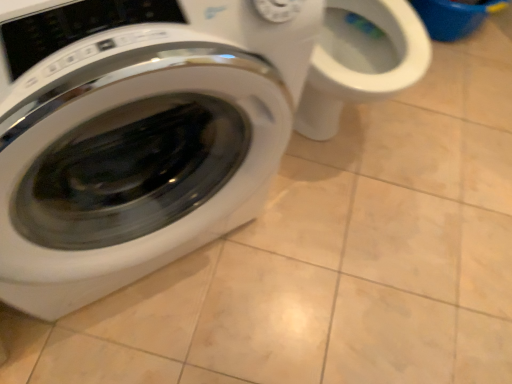
Question: Should I look upward or downward to see white glossy washing machine at left?

Choices:
 (A) up
 (B) down

Answer: (A)